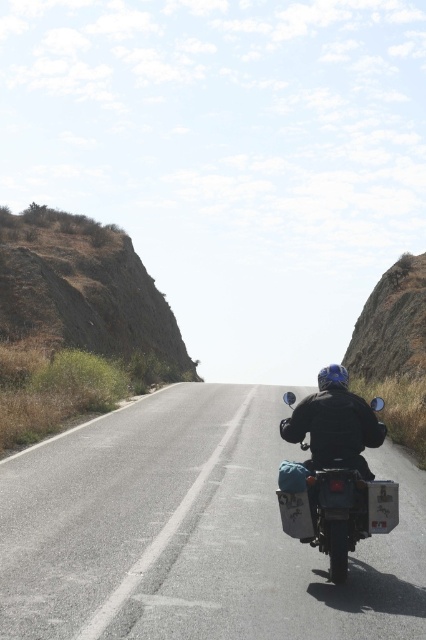
Question: Which point is closer to the camera?

Choices:
 (A) matte black motorcycle at center
 (B) asphalt road at center

Answer: (B)

Question: Which point is farther from the camera taking this photo?

Choices:
 (A) (328, 458)
 (B) (132, 611)

Answer: (A)

Question: Can you confirm if asphalt road at center is thinner than matte black motorcycle at center?

Choices:
 (A) no
 (B) yes

Answer: (A)

Question: Does asphalt road at center appear on the left side of matte black motorcycle at center?

Choices:
 (A) yes
 (B) no

Answer: (A)

Question: Can you confirm if asphalt road at center is smaller than matte black motorcycle at center?

Choices:
 (A) yes
 (B) no

Answer: (B)